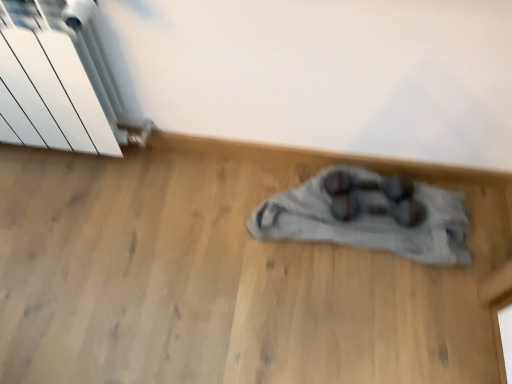
Question: Is shiny black dumbbells at center in front of or behind white metallic radiator at upper left in the image?

Choices:
 (A) behind
 (B) front

Answer: (A)

Question: In the image, is shiny black dumbbells at center on the left side or the right side of white metallic radiator at upper left?

Choices:
 (A) left
 (B) right

Answer: (B)

Question: From a real-world perspective, is shiny black dumbbells at center positioned above or below white metallic radiator at upper left?

Choices:
 (A) above
 (B) below

Answer: (B)

Question: Is white metallic radiator at upper left to the left or to the right of shiny black dumbbells at center in the image?

Choices:
 (A) left
 (B) right

Answer: (A)

Question: Considering their positions, is white metallic radiator at upper left located in front of or behind shiny black dumbbells at center?

Choices:
 (A) behind
 (B) front

Answer: (B)

Question: From the image's perspective, is white metallic radiator at upper left positioned above or below shiny black dumbbells at center?

Choices:
 (A) below
 (B) above

Answer: (B)

Question: In terms of size, does white metallic radiator at upper left appear bigger or smaller than shiny black dumbbells at center?

Choices:
 (A) small
 (B) big

Answer: (B)